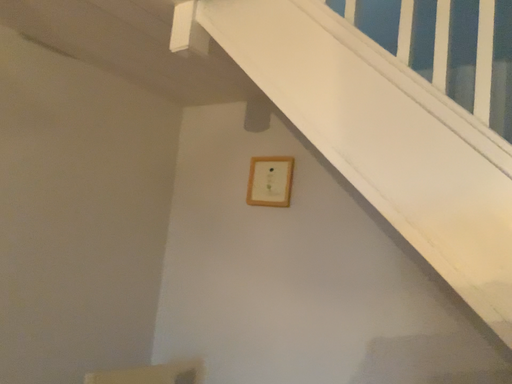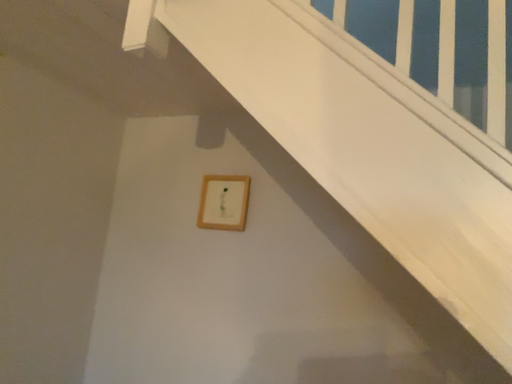
Question: Which way did the camera rotate in the video?

Choices:
 (A) rotated left
 (B) rotated right

Answer: (B)